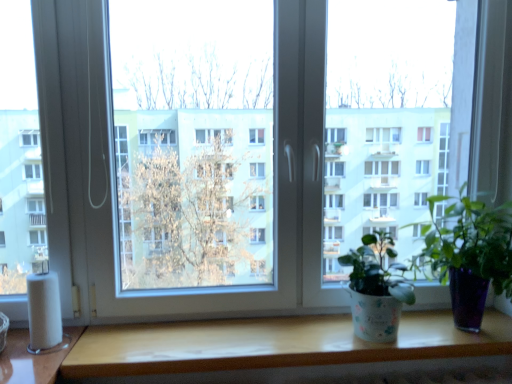
Image resolution: width=512 pixels, height=384 pixels. I want to click on free spot to the left of white textured pot at center, which ranks as the first houseplant in left-to-right order, so click(304, 336).